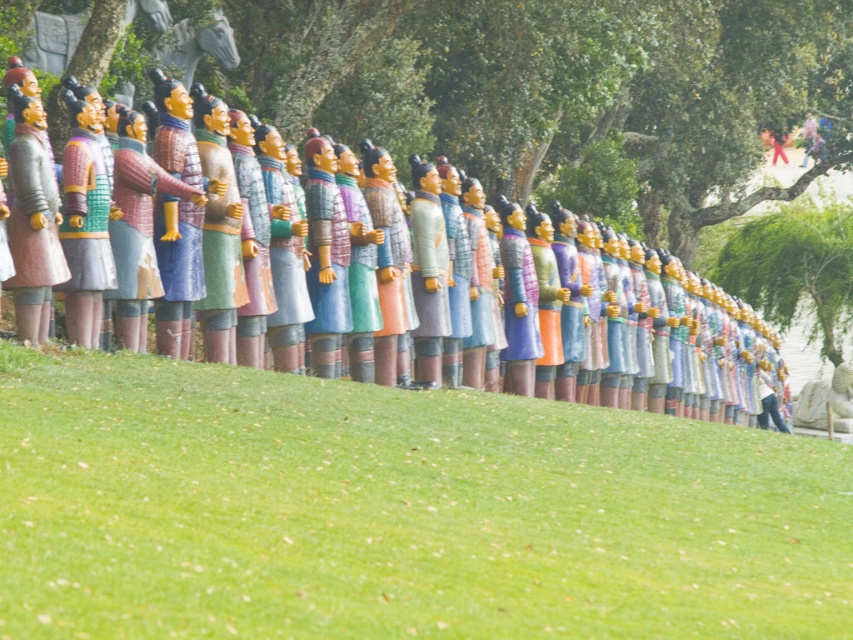
Can you confirm if green grass at lower center is bigger than green leafy tree at upper center?

Actually, green grass at lower center might be smaller than green leafy tree at upper center.

Is green grass at lower center taller than green leafy tree at upper center?

No.

Between point (498, 476) and point (675, 26), which one is positioned in front?

Point (498, 476)

Where is `green grass at lower center`? green grass at lower center is located at coordinates pos(397,512).

Does green leafy tree at upper center have a lesser height compared to matte painted statue at center?

Incorrect, green leafy tree at upper center's height does not fall short of matte painted statue at center's.

The width and height of the screenshot is (853, 640). What do you see at coordinates (560, 92) in the screenshot?
I see `green leafy tree at upper center` at bounding box center [560, 92].

Who is more forward, (84, 19) or (488, 257)?

Positioned in front is point (488, 257).

Locate an element on the screen. This screenshot has width=853, height=640. green leafy tree at upper center is located at coordinates click(x=560, y=92).

Does point (193, 522) come in front of point (277, 141)?

Yes.

The height and width of the screenshot is (640, 853). What do you see at coordinates (397, 512) in the screenshot?
I see `green grass at lower center` at bounding box center [397, 512].

Describe the element at coordinates (397, 512) in the screenshot. I see `green grass at lower center` at that location.

This screenshot has height=640, width=853. Find the location of `green grass at lower center`. green grass at lower center is located at coordinates (397, 512).